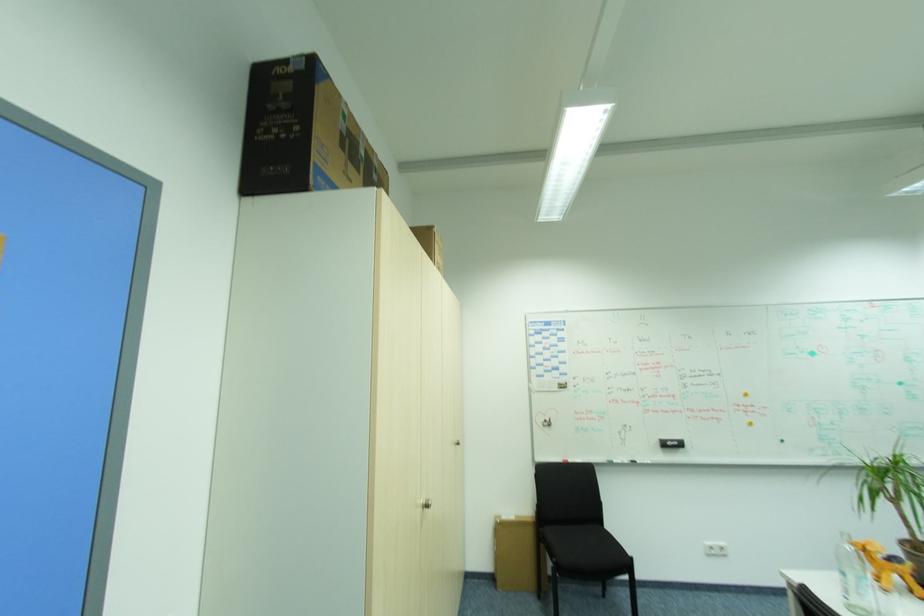
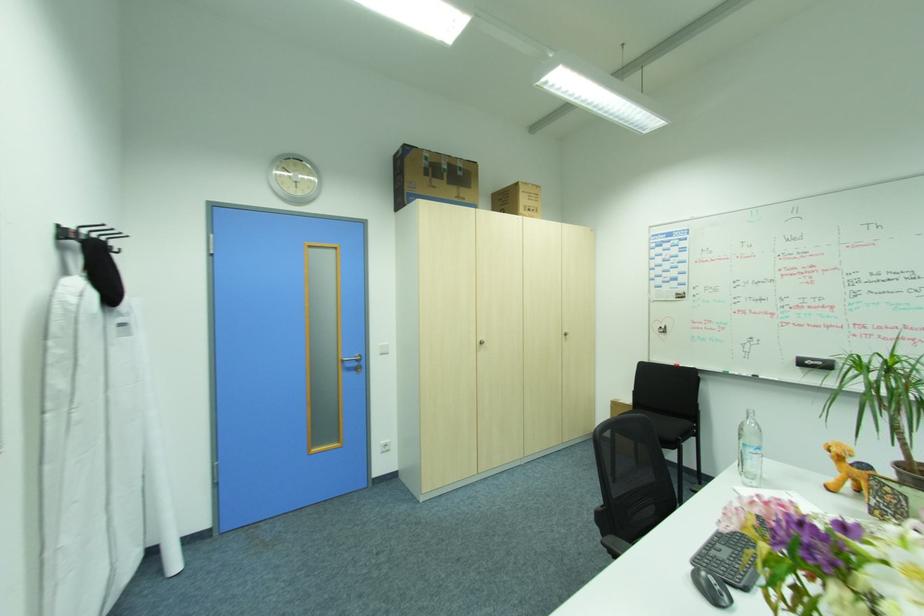
Find the pixel in the second image that matches point (874, 543) in the first image.

(844, 446)